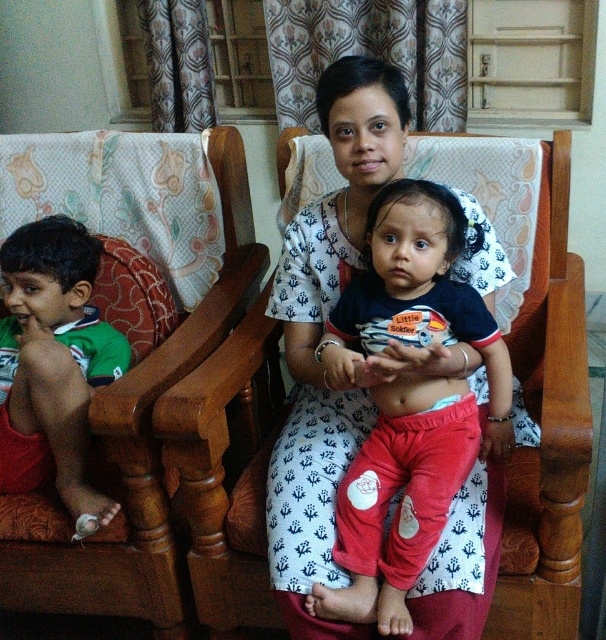
Question: Among these points, which one is farthest from the camera?

Choices:
 (A) (445, 381)
 (B) (38, 227)
 (C) (210, 292)
 (D) (178, 444)

Answer: (C)

Question: Which point appears farthest from the camera in this image?

Choices:
 (A) (12, 362)
 (B) (441, 257)
 (C) (578, 470)

Answer: (A)

Question: Considering the relative positions of wooden rocking chair at center and brown wood rocking chair at left in the image provided, where is wooden rocking chair at center located with respect to brown wood rocking chair at left?

Choices:
 (A) below
 (B) above

Answer: (B)

Question: Considering the relative positions of brown wood rocking chair at left and green jersey at left in the image provided, where is brown wood rocking chair at left located with respect to green jersey at left?

Choices:
 (A) above
 (B) below

Answer: (A)

Question: Does matte black shirt at center have a lesser width compared to brown wood rocking chair at left?

Choices:
 (A) yes
 (B) no

Answer: (A)

Question: Which point is farther from the camera taking this photo?

Choices:
 (A) (164, 595)
 (B) (93, 513)

Answer: (A)